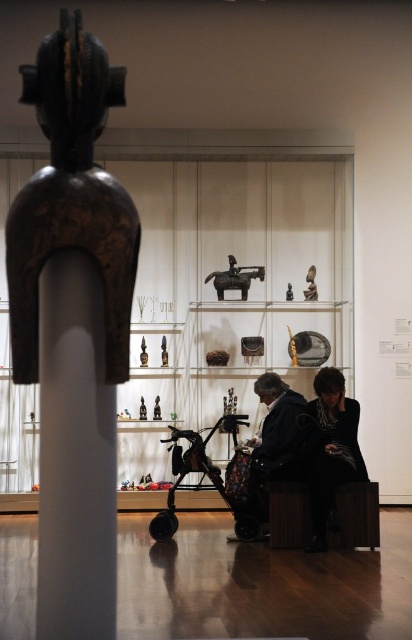
You are standing in the museum and want to see the artifacts in the display case. There is a large dark wooden sculpture blocking your view. Where is the point at coordinates (74, 456) located?

The point at coordinates (74, 456) is located on the white glossy pillar at center, which might be part of the display case structure, possibly between the sculpture and the case, allowing you to navigate around it for a better view.

You are standing in front of the museum display case and want to see the artifacts inside. However, there is a large sculpture blocking your view. Where is the black polished wood figure at center located in terms of its 2D coordinates?

The black polished wood figure at center is located at the 2D coordinates of point (74, 326).